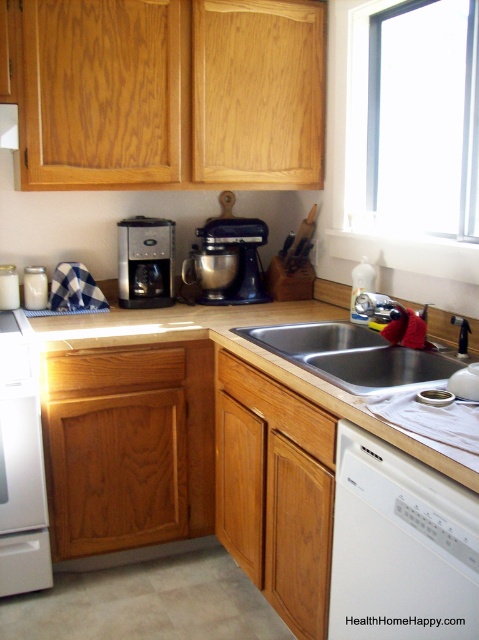
Question: Observing the image, what is the correct spatial positioning of wooden at lower left in reference to matte black stand mixer at center?

Choices:
 (A) below
 (B) above

Answer: (A)

Question: Can you confirm if transparent glass window at upper right is positioned above white matte refrigerator at lower left?

Choices:
 (A) yes
 (B) no

Answer: (A)

Question: Among these points, which one is nearest to the camera?

Choices:
 (A) (437, 148)
 (B) (205, 314)
 (C) (335, 356)

Answer: (C)

Question: Does transparent glass window at upper right appear on the left side of white plastic dishwasher at lower right?

Choices:
 (A) yes
 (B) no

Answer: (B)

Question: Which object is positioned closest to the white plastic dishwasher at lower right?

Choices:
 (A) transparent glass window at upper right
 (B) white matte refrigerator at lower left
 (C) satin black coffee maker at center
 (D) matte black stand mixer at center

Answer: (B)

Question: Which point is closer to the camera?

Choices:
 (A) (314, 349)
 (B) (237, 250)

Answer: (A)